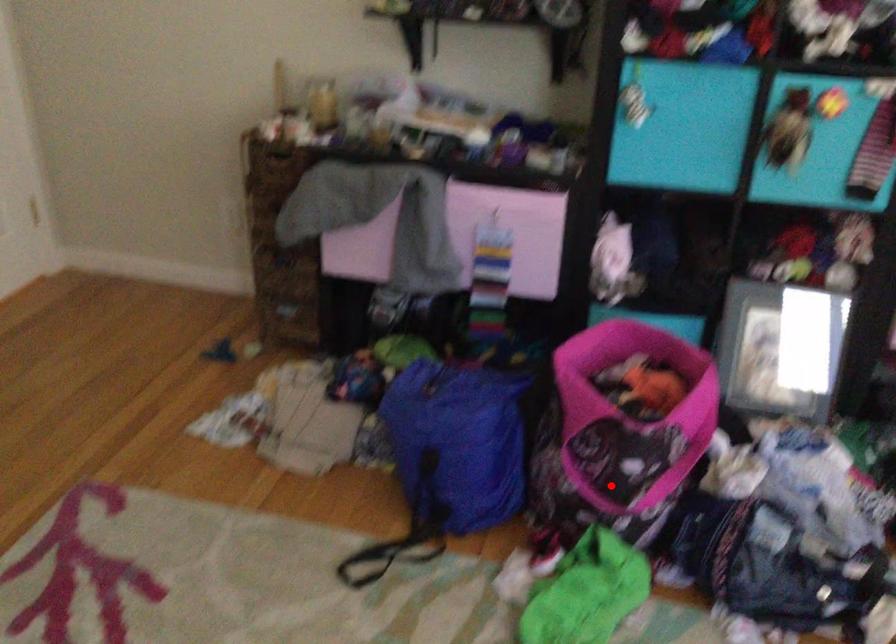
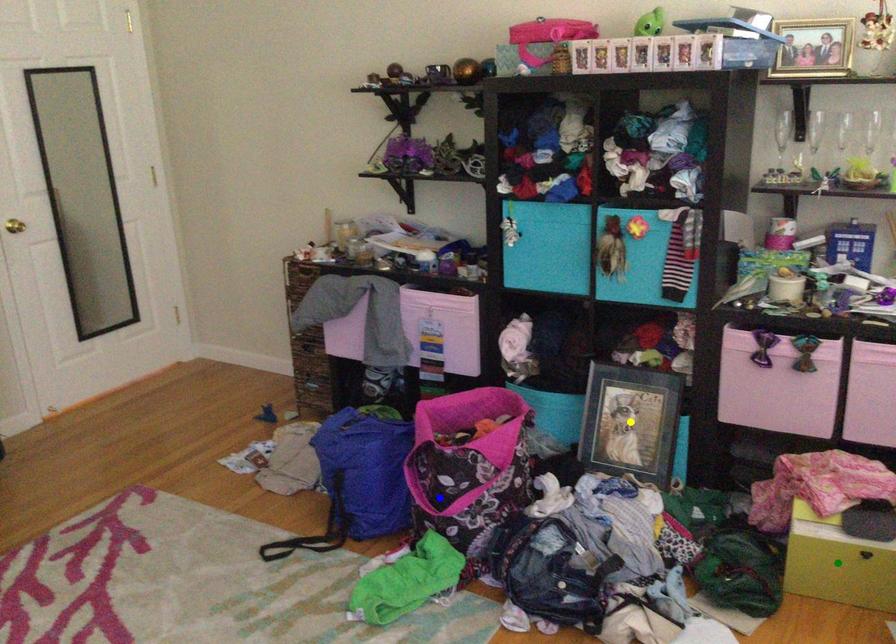
Question: I am providing you with two images of the same scene from different viewpoints. A red point is marked on the first image. You are given multiple points on the second image. Which point in image 2 is actually the same real-world point as the red point in image 1?

Choices:
 (A) green point
 (B) blue point
 (C) yellow point

Answer: (B)